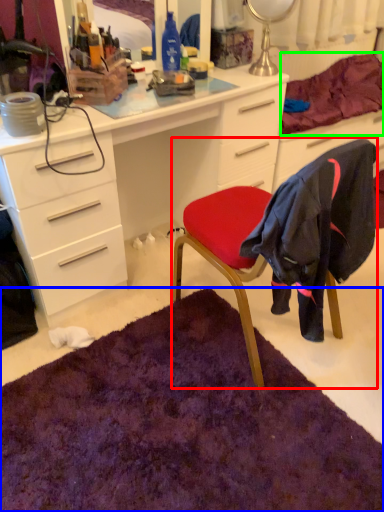
Question: Estimate the real-world distances between objects in this image. Which object is farther from chair (highlighted by a red box), mat (highlighted by a blue box) or bedding (highlighted by a green box)?

Choices:
 (A) mat
 (B) bedding

Answer: (B)